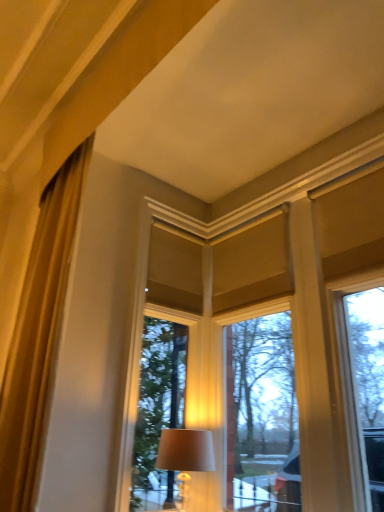
This screenshot has height=512, width=384. What are the coordinates of `matte cream window at center` in the screenshot? It's located at (262, 416).

What do you see at coordinates (185, 457) in the screenshot? I see `matte beige lampshade at center` at bounding box center [185, 457].

Locate an element on the screen. The height and width of the screenshot is (512, 384). matte cream window at center is located at coordinates pyautogui.click(x=262, y=416).

The width and height of the screenshot is (384, 512). I want to click on bay window on the right of the gold silky curtain at left, so click(x=262, y=416).

Can you tell me how much matte cream window at center and gold silky curtain at left differ in facing direction?

There is a 0.34-degree angle between the facing directions of matte cream window at center and gold silky curtain at left.

Considering the relative sizes of matte cream window at center and gold silky curtain at left in the image provided, is matte cream window at center bigger than gold silky curtain at left?

Indeed, matte cream window at center has a larger size compared to gold silky curtain at left.

From a real-world perspective, is matte cream window at center physically above gold silky curtain at left?

Incorrect, from a real-world perspective, matte cream window at center is lower than gold silky curtain at left.

Is matte beige lampshade at center inside or outside of matte cream window at center?

matte beige lampshade at center is not enclosed by matte cream window at center.

From a real-world perspective, is matte beige lampshade at center physically located above or below matte cream window at center?

matte beige lampshade at center is below matte cream window at center.

Is matte cream window at center at the back of matte beige lampshade at center?

Yes, matte beige lampshade at center is positioned with its back facing matte cream window at center.

Considering the relative sizes of matte beige lampshade at center and matte cream window at center in the image provided, is matte beige lampshade at center taller than matte cream window at center?

No, matte beige lampshade at center is not taller than matte cream window at center.

Considering the relative sizes of matte cream window at center and matte beige lampshade at center in the image provided, is matte cream window at center taller than matte beige lampshade at center?

Yes.

Is matte cream window at center far away from matte beige lampshade at center?

No, there isn't a large distance between matte cream window at center and matte beige lampshade at center.

Between matte cream window at center and matte beige lampshade at center, which one has larger width?

matte beige lampshade at center.

Which is in front, point (76, 223) or point (202, 455)?

Point (76, 223)

The height and width of the screenshot is (512, 384). Find the location of `lamp that is on the right side of gold silky curtain at left`. lamp that is on the right side of gold silky curtain at left is located at coordinates (185, 457).

What's the angular difference between gold silky curtain at left and matte beige lampshade at center's facing directions?

They differ by 0.181 degrees in their facing directions.

Who is smaller, gold silky curtain at left or matte beige lampshade at center?

matte beige lampshade at center.

From the image's perspective, is matte beige lampshade at center on top of gold silky curtain at left?

Incorrect, from the image's perspective, matte beige lampshade at center is lower than gold silky curtain at left.

Is matte beige lampshade at center not near gold silky curtain at left?

matte beige lampshade at center is near gold silky curtain at left, not far away.

Who is more distant, matte beige lampshade at center or gold silky curtain at left?

matte beige lampshade at center.

From their relative heights in the image, would you say matte beige lampshade at center is taller or shorter than gold silky curtain at left?

Considering their sizes, matte beige lampshade at center has less height than gold silky curtain at left.

Does gold silky curtain at left touch matte cream window at center?

No, gold silky curtain at left is not making contact with matte cream window at center.

Is gold silky curtain at left to the left of matte cream window at center from the viewer's perspective?

Yes.

Considering the sizes of gold silky curtain at left and matte cream window at center in the image, is gold silky curtain at left taller or shorter than matte cream window at center?

Clearly, gold silky curtain at left is shorter compared to matte cream window at center.

Based on the photo, from the image's perspective, between gold silky curtain at left and matte cream window at center, which one is located above?

gold silky curtain at left.

You are a GUI agent. You are given a task and a screenshot of the screen. Output one action in this format:
    pyautogui.click(x=<x>, y=<y>)
    Task: Click on the curtain in front of the matte cream window at center
    Image resolution: width=384 pixels, height=512 pixels.
    Given the screenshot: What is the action you would take?
    pyautogui.click(x=38, y=337)

Where is `lamp that is behind the matte cream window at center`? The image size is (384, 512). lamp that is behind the matte cream window at center is located at coordinates (185, 457).

Based on their spatial positions, is matte cream window at center or gold silky curtain at left further from matte beige lampshade at center?

Based on the image, gold silky curtain at left appears to be further to matte beige lampshade at center.

From the image, which object appears to be nearer to matte cream window at center, gold silky curtain at left or matte beige lampshade at center?

matte beige lampshade at center is positioned closer to the anchor matte cream window at center.

From the image, which object appears to be farther from matte cream window at center, matte beige lampshade at center or gold silky curtain at left?

gold silky curtain at left is further to matte cream window at center.

Estimate the real-world distances between objects in this image. Which object is further from matte beige lampshade at center, gold silky curtain at left or matte cream window at center?

gold silky curtain at left.

Considering their positions, is matte beige lampshade at center positioned further to gold silky curtain at left than matte cream window at center?

The object further to gold silky curtain at left is matte cream window at center.

From the image, which object appears to be nearer to gold silky curtain at left, matte cream window at center or matte beige lampshade at center?

matte beige lampshade at center is positioned closer to the anchor gold silky curtain at left.

What are the coordinates of `lamp located between gold silky curtain at left and matte cream window at center in the left-right direction` in the screenshot? It's located at (185, 457).